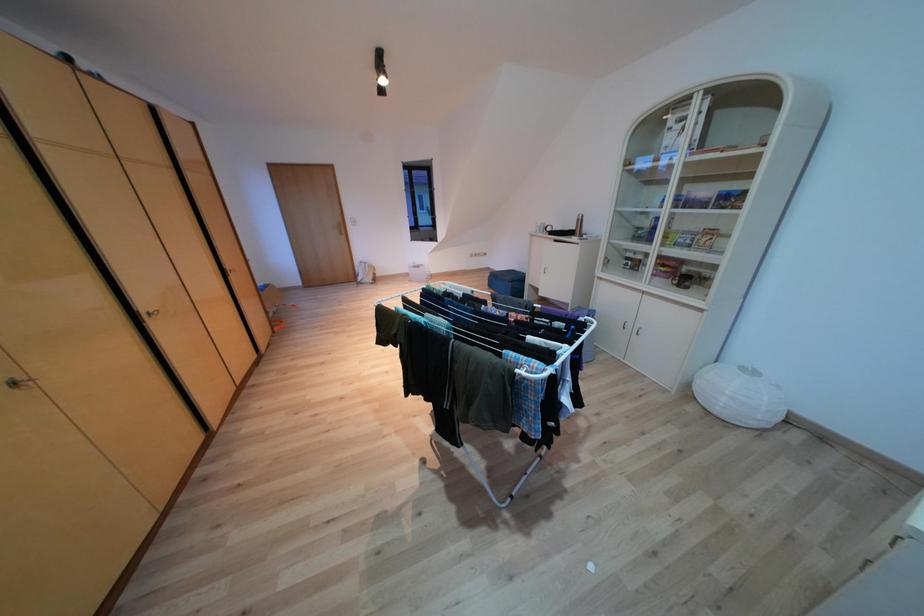
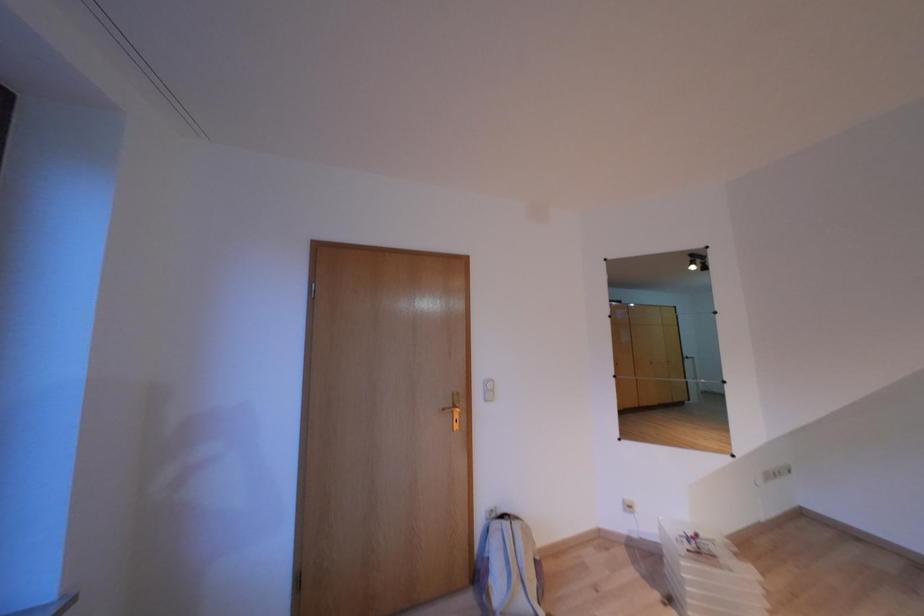
What movement of the cameraman would produce the second image?

The movement direction of the cameraman is left, forward.